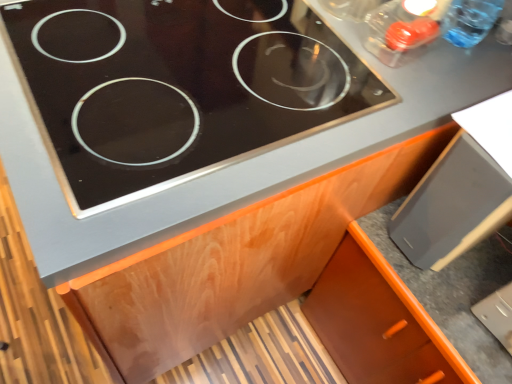
Where is `vacant area on the back side of transparent plastic bottle at upper right`? vacant area on the back side of transparent plastic bottle at upper right is located at coordinates (479, 14).